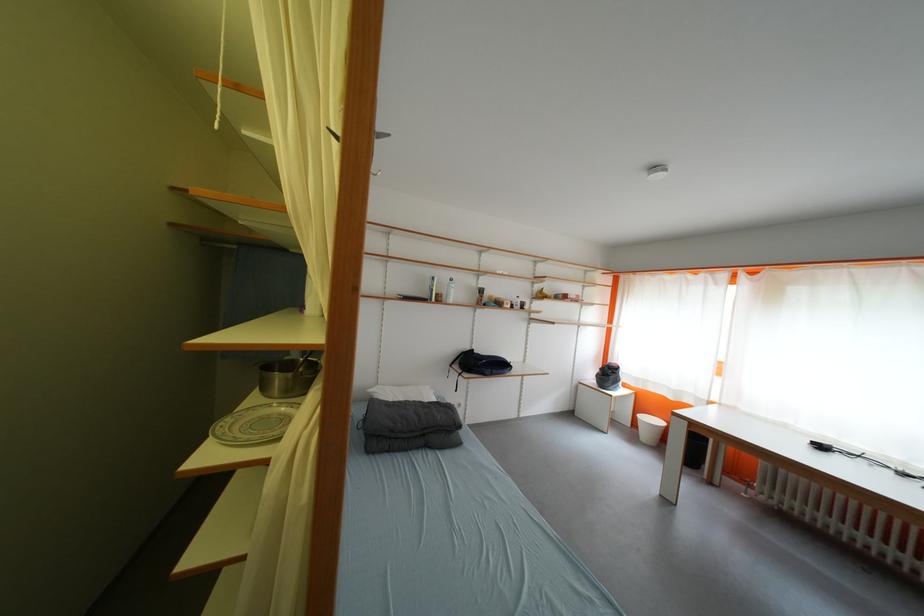
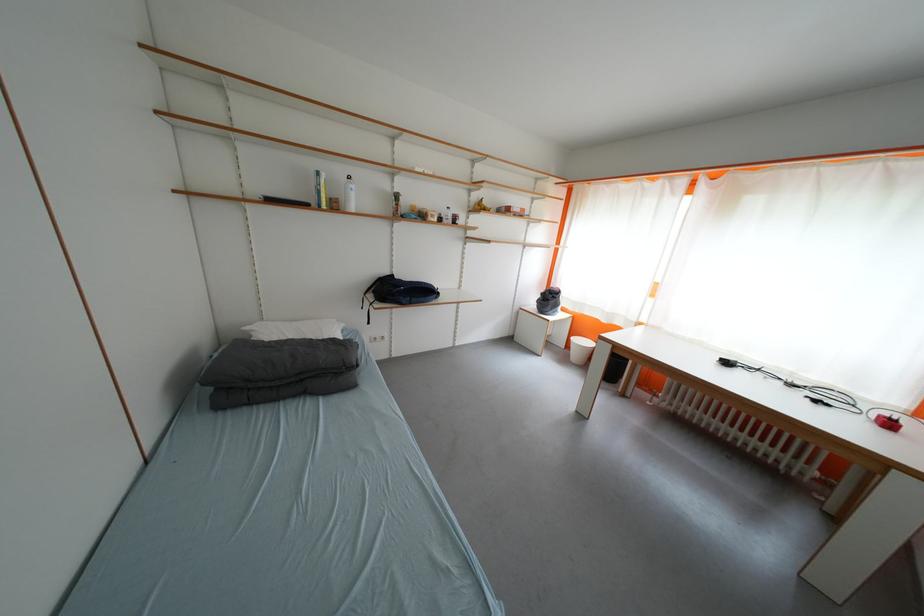
The point at (447, 302) is marked in the first image. Where is the corresponding point in the second image?

(344, 209)